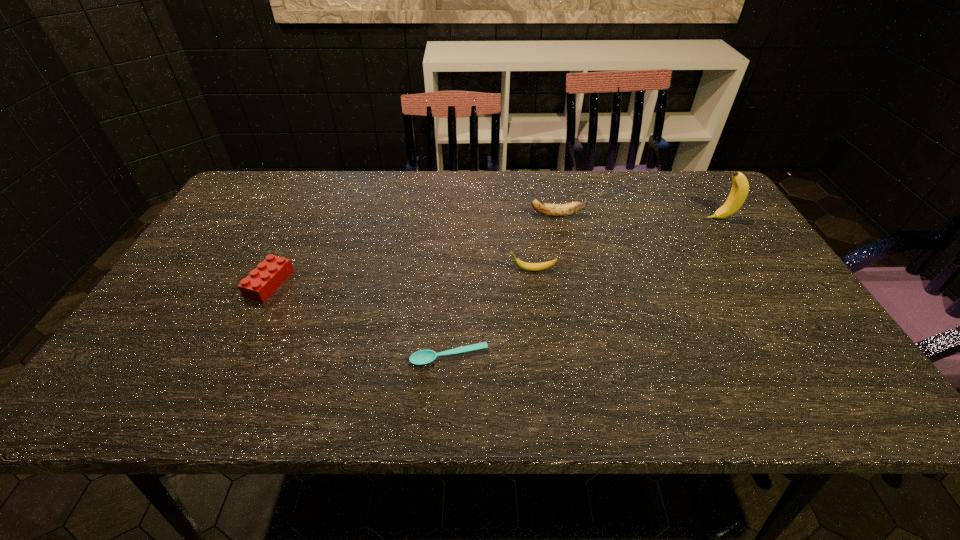
Identify the location of object located at the far edge. (555, 210).

This screenshot has height=540, width=960. Find the location of `object that is at the right edge`. object that is at the right edge is located at coordinates (740, 188).

You are a GUI agent. You are given a task and a screenshot of the screen. Output one action in this format:
    pyautogui.click(x=<x>, y=<y>)
    Task: Click on the vacant space at the far edge of the desktop
    
    Given the screenshot: What is the action you would take?
    pyautogui.click(x=664, y=186)

Find the location of a particular element. The image size is (960, 540). vacant region at the near edge of the desktop is located at coordinates (344, 383).

This screenshot has width=960, height=540. In order to click on vacant space at the left edge of the desktop in this screenshot , I will do `click(198, 254)`.

Identify the location of vacant area at the right edge. (712, 219).

Where is `vacant space at the far left corner of the desktop`? vacant space at the far left corner of the desktop is located at coordinates (278, 170).

Where is `vacant area that lies between the Lego and the spoon`? The height and width of the screenshot is (540, 960). vacant area that lies between the Lego and the spoon is located at coordinates (359, 320).

The height and width of the screenshot is (540, 960). In order to click on empty location between the fourth object from right to left and the nearest banana in this screenshot , I will do `click(491, 314)`.

At what (x,y) coordinates should I click in order to perform the action: click on vacant point located between the second tallest banana and the Lego. Please return your answer as a coordinate pair (x, y). Looking at the image, I should click on (413, 249).